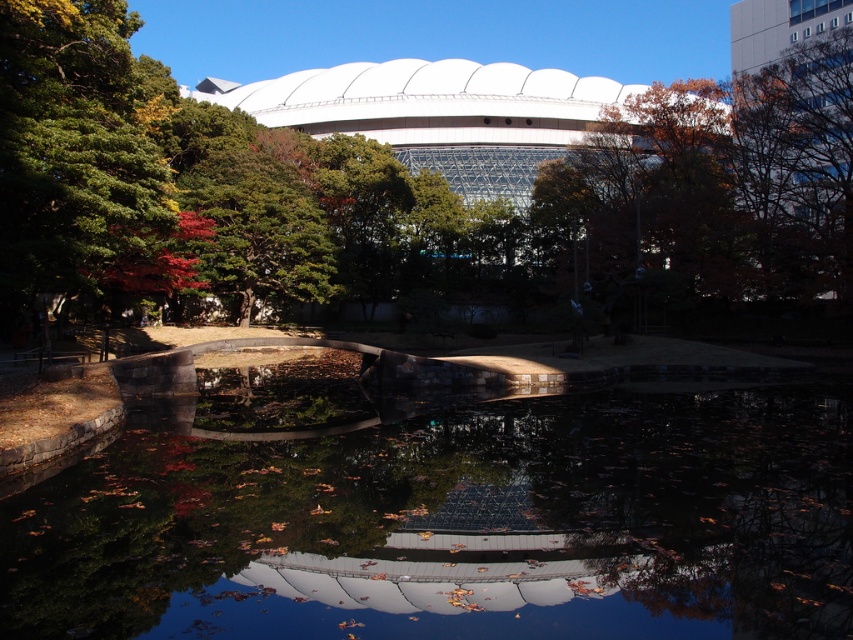
Question: Among these objects, which one is nearest to the camera?

Choices:
 (A) dark reflective water at center
 (B) green leafy tree at left

Answer: (A)

Question: Which is nearer to the dark reflective water at center?

Choices:
 (A) green leafy tree at center
 (B) green leafy tree at left

Answer: (B)

Question: Is green leafy tree at center wider than dark reflective water at center?

Choices:
 (A) yes
 (B) no

Answer: (A)

Question: Among these points, which one is nearest to the camera?

Choices:
 (A) (94, 113)
 (B) (810, 200)

Answer: (A)

Question: Is green leafy tree at center wider than dark reflective water at center?

Choices:
 (A) yes
 (B) no

Answer: (A)

Question: Is dark reflective water at center bigger than green leafy tree at left?

Choices:
 (A) yes
 (B) no

Answer: (B)